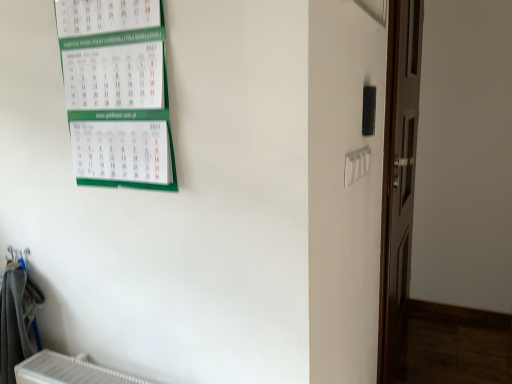
Where is `brown wooden door at right`? The height and width of the screenshot is (384, 512). brown wooden door at right is located at coordinates click(x=398, y=176).

Looking at this image, is gray fabric laundry at lower left positioned with its back to green paper calendar at upper left?

No.

Which of these two, gray fabric laundry at lower left or green paper calendar at upper left, is bigger?

gray fabric laundry at lower left.

Looking at this image, is gray fabric laundry at lower left behind green paper calendar at upper left?

Yes, it is behind green paper calendar at upper left.

Is green paper calendar at upper left completely or partially outside of brown wooden door at right?

Yes, green paper calendar at upper left is outside of brown wooden door at right.

I want to click on bulletin board lying above the brown wooden door at right (from the image's perspective), so click(x=117, y=92).

Based on the photo, is green paper calendar at upper left positioned behind brown wooden door at right?

No, the depth of green paper calendar at upper left is less than that of brown wooden door at right.

From a real-world perspective, is brown wooden door at right located higher than green paper calendar at upper left?

Incorrect, from a real-world perspective, brown wooden door at right is lower than green paper calendar at upper left.

Identify the location of door behind the green paper calendar at upper left. (398, 176).

From the image's perspective, is brown wooden door at right under green paper calendar at upper left?

Correct, brown wooden door at right appears lower than green paper calendar at upper left in the image.

Is brown wooden door at right not near green paper calendar at upper left?

Absolutely, brown wooden door at right is distant from green paper calendar at upper left.

Which of these two, green paper calendar at upper left or gray fabric laundry at lower left, is wider?

gray fabric laundry at lower left is wider.

Which is closer to the camera, (153,18) or (4,313)?

Point (153,18) is positioned closer to the camera compared to point (4,313).

Is green paper calendar at upper left facing away from gray fabric laundry at lower left?

No, green paper calendar at upper left is not facing the opposite direction of gray fabric laundry at lower left.

Is green paper calendar at upper left to the right of gray fabric laundry at lower left from the viewer's perspective?

Yes.

Considering the sizes of objects brown wooden door at right and gray fabric laundry at lower left in the image provided, who is taller, brown wooden door at right or gray fabric laundry at lower left?

brown wooden door at right.

Is point (404, 219) closer or farther from the camera than point (19, 351)?

Clearly, point (404, 219) is more distant from the camera than point (19, 351).

From the image's perspective, is brown wooden door at right on gray fabric laundry at lower left?

Yes, from the image's perspective, brown wooden door at right is over gray fabric laundry at lower left.

Is gray fabric laundry at lower left outside of brown wooden door at right?

Yes, gray fabric laundry at lower left is not within brown wooden door at right.

Based on the photo, considering the sizes of objects gray fabric laundry at lower left and brown wooden door at right in the image provided, who is bigger, gray fabric laundry at lower left or brown wooden door at right?

brown wooden door at right.

Is gray fabric laundry at lower left thinner than brown wooden door at right?

Incorrect, the width of gray fabric laundry at lower left is not less than that of brown wooden door at right.

Based on the photo, considering the relative sizes of gray fabric laundry at lower left and brown wooden door at right in the image provided, is gray fabric laundry at lower left shorter than brown wooden door at right?

Yes.

Identify the location of bulletin board that appears above the gray fabric laundry at lower left (from the image's perspective). Image resolution: width=512 pixels, height=384 pixels. (117, 92).

What are the coordinates of `door that appears on the right of green paper calendar at upper left` in the screenshot? It's located at (398, 176).

When comparing their distances from green paper calendar at upper left, does gray fabric laundry at lower left or brown wooden door at right seem closer?

Based on the image, gray fabric laundry at lower left appears to be nearer to green paper calendar at upper left.

Which object lies further to the anchor point gray fabric laundry at lower left, green paper calendar at upper left or brown wooden door at right?

brown wooden door at right is further to gray fabric laundry at lower left.

Which object lies further to the anchor point gray fabric laundry at lower left, brown wooden door at right or green paper calendar at upper left?

brown wooden door at right lies further to gray fabric laundry at lower left than the other object.

In the scene shown: From the image, which object appears to be farther from brown wooden door at right, gray fabric laundry at lower left or green paper calendar at upper left?

Among the two, gray fabric laundry at lower left is located further to brown wooden door at right.

From the image, which object appears to be nearer to brown wooden door at right, green paper calendar at upper left or gray fabric laundry at lower left?

green paper calendar at upper left lies closer to brown wooden door at right than the other object.

Based on their spatial positions, is brown wooden door at right or gray fabric laundry at lower left closer to green paper calendar at upper left?

gray fabric laundry at lower left is closer to green paper calendar at upper left.

You are a GUI agent. You are given a task and a screenshot of the screen. Output one action in this format:
    pyautogui.click(x=<x>, y=<y>)
    Task: Click on the bulletin board situated between gray fabric laundry at lower left and brown wooden door at right from left to right
    The width and height of the screenshot is (512, 384).
    Given the screenshot: What is the action you would take?
    pyautogui.click(x=117, y=92)